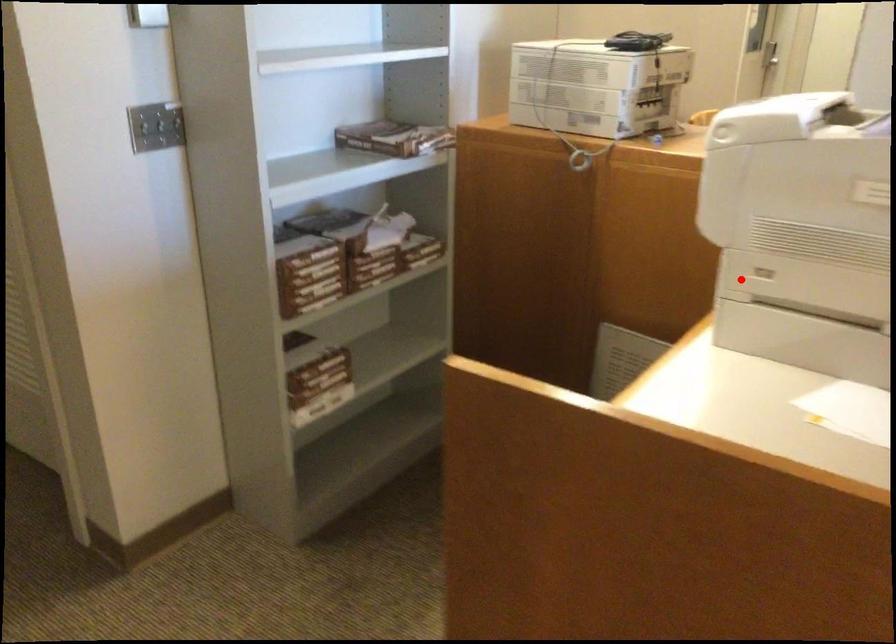
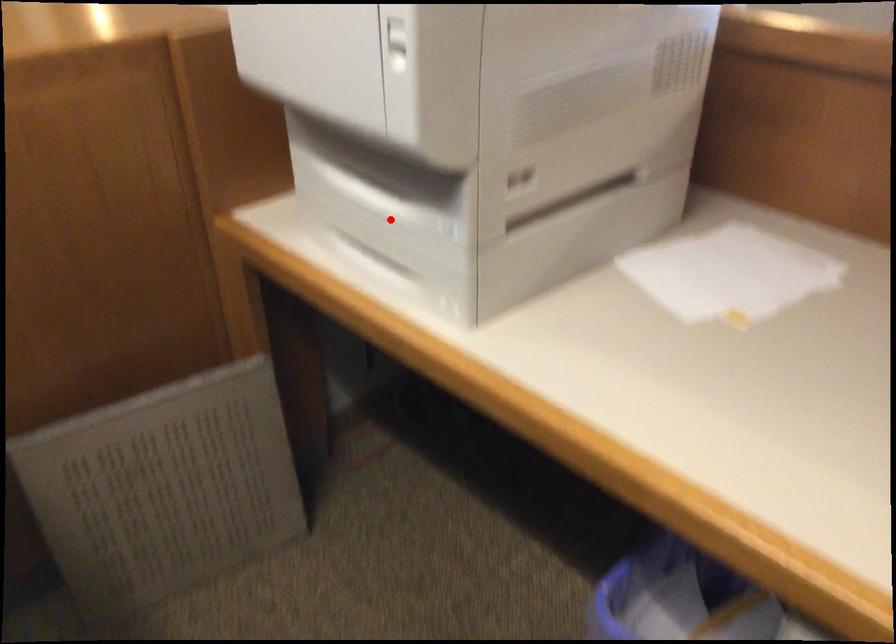
I am providing you with two images of the same scene from different viewpoints. A red point is marked on the first image and another point is marked on the second image. Is the red point in image1 aligned with the point shown in image2?

Yes